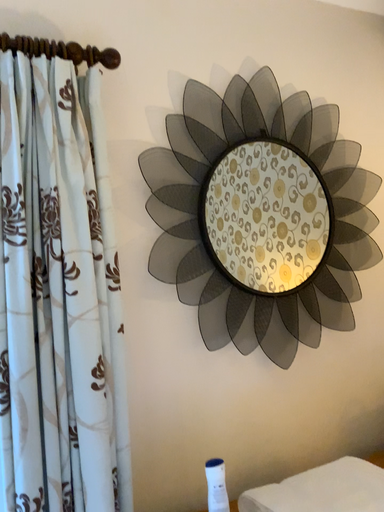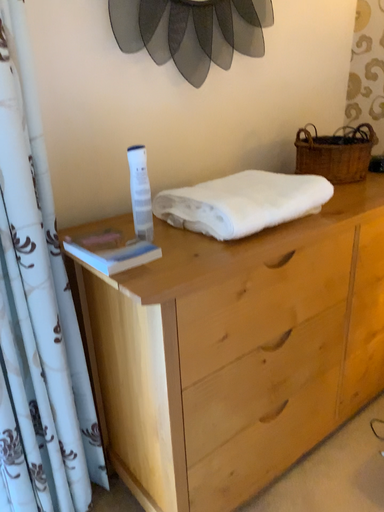
Question: Which way did the camera rotate in the video?

Choices:
 (A) rotated right
 (B) rotated left

Answer: (A)